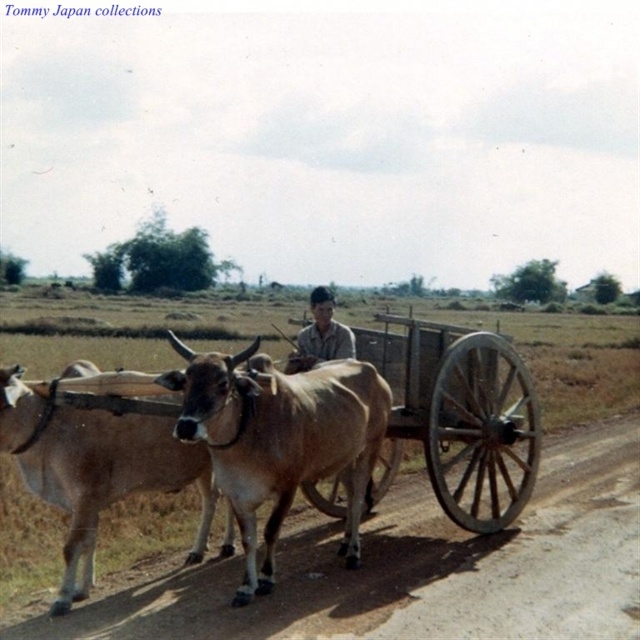
Does light brown glossy bull at center appear under wooden wagon at center?

Yes, light brown glossy bull at center is below wooden wagon at center.

Can you confirm if light brown glossy bull at center is positioned to the left of wooden wagon at center?

Yes, light brown glossy bull at center is to the left of wooden wagon at center.

Between point (252, 540) and point (483, 339), which one is positioned in front?

Point (252, 540) is more forward.

The height and width of the screenshot is (640, 640). Identify the location of light brown glossy bull at center. (280, 438).

Which is below, light brown cow at center or light brown shirt at center?

Positioned lower is light brown cow at center.

Consider the image. Does light brown cow at center lie behind light brown shirt at center?

No, light brown cow at center is closer to the viewer.

Does point (29, 388) come farther from viewer compared to point (326, 326)?

No, it is in front of (326, 326).

This screenshot has width=640, height=640. What are the coordinates of `light brown cow at center` in the screenshot? It's located at click(x=96, y=468).

Does wooden wagon at center have a greater height compared to light brown cow at center?

Correct, wooden wagon at center is much taller as light brown cow at center.

Is point (452, 374) closer to camera compared to point (157, 481)?

No, it is behind (157, 481).

Identify the location of wooden wagon at center. The image size is (640, 640). (458, 417).